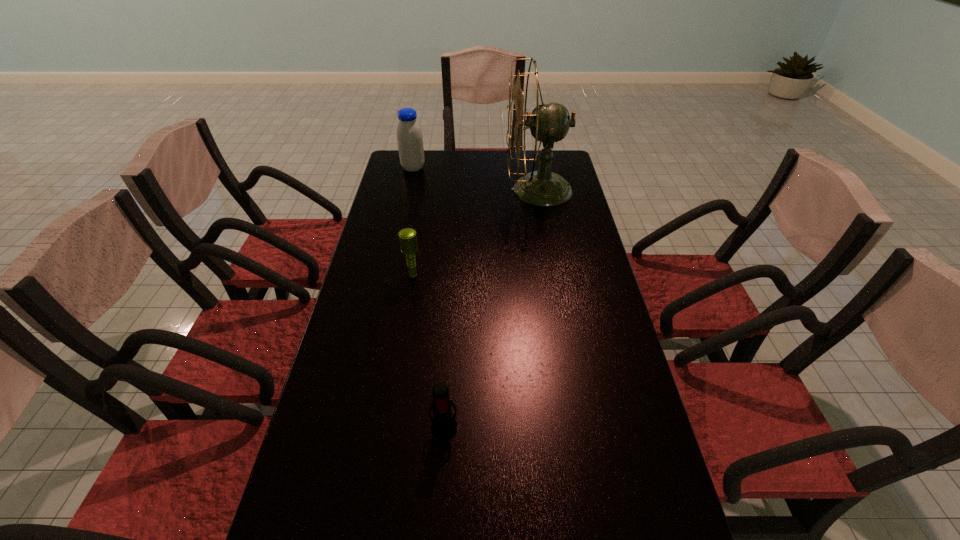
Find the location of a particular element. free area in between the farther microphone and the third shortest object is located at coordinates (413, 221).

Locate an element on the screen. This screenshot has height=540, width=960. free space between the nearest object and the tallest object is located at coordinates (492, 307).

Image resolution: width=960 pixels, height=540 pixels. Find the location of `unoccupied area between the left microphone and the third shortest object`. unoccupied area between the left microphone and the third shortest object is located at coordinates (413, 221).

Choose which object is the second nearest neighbor to the rightmost object. Please provide its 2D coordinates. Your answer should be formatted as a tuple, i.e. [(x, y)], where the tuple contains the x and y coordinates of a point satisfying the conditions above.

[(408, 239)]

Select which object is the third closest to the fan. Please provide its 2D coordinates. Your answer should be formatted as a tuple, i.e. [(x, y)], where the tuple contains the x and y coordinates of a point satisfying the conditions above.

[(444, 426)]

Locate an element on the screen. blank space that satisfies the following two spatial constraints: 1. in front of the fan, directing air flow; 2. on the front side of the second object from right to left is located at coordinates (582, 425).